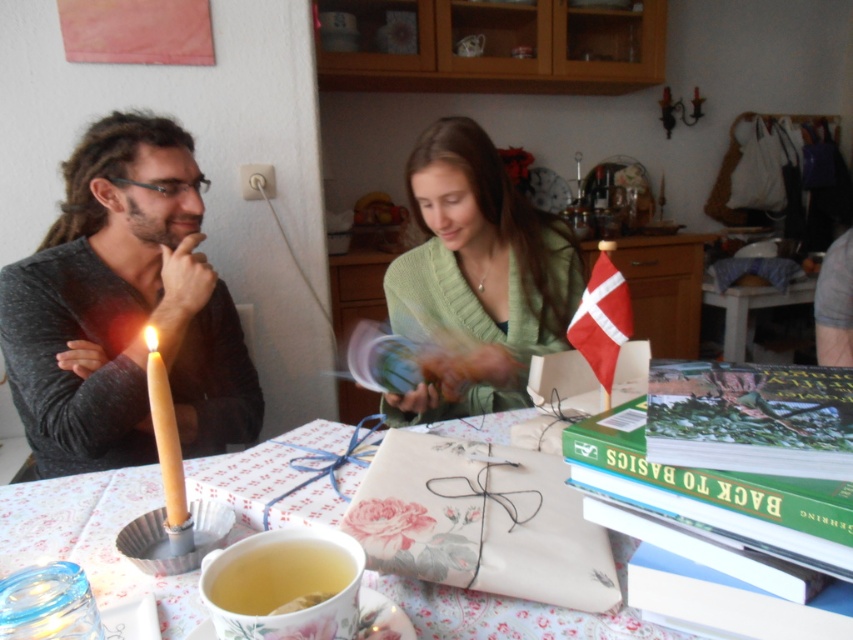
You are organizing a gift wrapping station and need to determine which item takes up more space. Based on the scene, which object occupies a larger area between the floral paper wrapped gift at center and the green matte sweater at center?

The green matte sweater at center occupies a larger area than the floral paper wrapped gift at center.